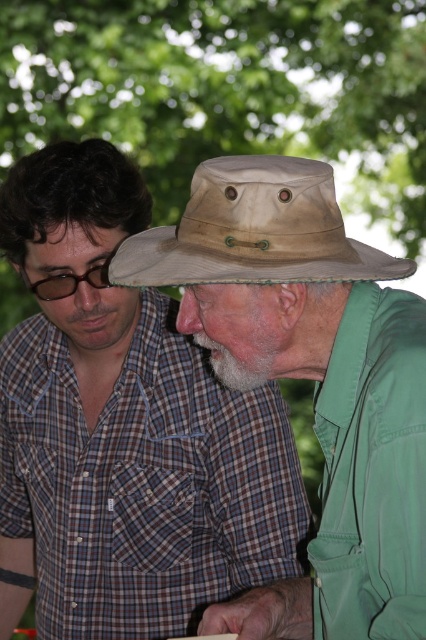
Question: Which point appears closest to the camera in this image?

Choices:
 (A) (181, 524)
 (B) (189, 243)
 (C) (396, 504)

Answer: (C)

Question: Is plaid cotton shirt at center positioned in front of tan canvas hat at center?

Choices:
 (A) yes
 (B) no

Answer: (B)

Question: Which point is closer to the camera?

Choices:
 (A) (206, 180)
 (B) (52, 568)
 (C) (218, 624)

Answer: (A)

Question: Can you confirm if plaid cotton shirt at center is smaller than tan canvas hat at center?

Choices:
 (A) no
 (B) yes

Answer: (A)

Question: Which point is farther to the camera?

Choices:
 (A) khaki fabric hat at center
 (B) plaid cotton shirt at center

Answer: (B)

Question: Does khaki fabric hat at center appear over tan canvas hat at center?

Choices:
 (A) yes
 (B) no

Answer: (B)